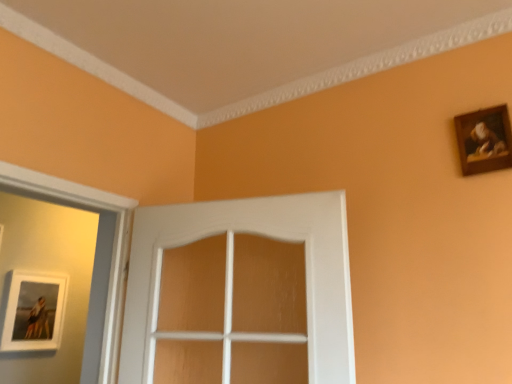
Question: From a real-world perspective, does matte white picture frame at lower left, positioned as the second picture frame in top-to-bottom order, sit lower than wooden frame at upper right, the 2th picture frame when ordered from bottom to top?

Choices:
 (A) no
 (B) yes

Answer: (B)

Question: Can you confirm if matte white picture frame at lower left, positioned as the second picture frame in top-to-bottom order, is positioned to the left of wooden frame at upper right, which is counted as the first picture frame, starting from the front?

Choices:
 (A) no
 (B) yes

Answer: (B)

Question: Is matte white picture frame at lower left, which is the first picture frame from bottom to top, positioned in front of wooden frame at upper right, the first picture frame viewed from the top?

Choices:
 (A) no
 (B) yes

Answer: (A)

Question: Is matte white picture frame at lower left, which is counted as the 2th picture frame, starting from the right, directly adjacent to wooden frame at upper right, which is counted as the first picture frame, starting from the front?

Choices:
 (A) no
 (B) yes

Answer: (A)

Question: Is matte white picture frame at lower left, the 1th picture frame when ordered from left to right, further to camera compared to wooden frame at upper right, the first picture frame viewed from the top?

Choices:
 (A) yes
 (B) no

Answer: (A)

Question: Is matte white picture frame at lower left, which ranks as the 1th picture frame in back-to-front order, turned away from wooden frame at upper right, which is counted as the first picture frame, starting from the front?

Choices:
 (A) yes
 (B) no

Answer: (B)

Question: From the image's perspective, is white wood door at center beneath matte white picture frame at lower left, which is the first picture frame from bottom to top?

Choices:
 (A) yes
 (B) no

Answer: (B)

Question: Is white wood door at center taller than matte white picture frame at lower left, positioned as the second picture frame in top-to-bottom order?

Choices:
 (A) no
 (B) yes

Answer: (B)

Question: Considering the relative positions of white wood door at center and matte white picture frame at lower left, positioned as the second picture frame in top-to-bottom order, in the image provided, is white wood door at center in front of matte white picture frame at lower left, positioned as the second picture frame in top-to-bottom order,?

Choices:
 (A) yes
 (B) no

Answer: (A)

Question: Would you say white wood door at center contains matte white picture frame at lower left, the 1th picture frame when ordered from left to right?

Choices:
 (A) no
 (B) yes

Answer: (A)

Question: Does white wood door at center lie behind matte white picture frame at lower left, which is the first picture frame from bottom to top?

Choices:
 (A) yes
 (B) no

Answer: (B)

Question: From a real-world perspective, is white wood door at center physically above matte white picture frame at lower left, which is the first picture frame from bottom to top?

Choices:
 (A) yes
 (B) no

Answer: (A)

Question: Is white wood door at center located within matte white picture frame at lower left, which is the first picture frame from bottom to top?

Choices:
 (A) yes
 (B) no

Answer: (B)